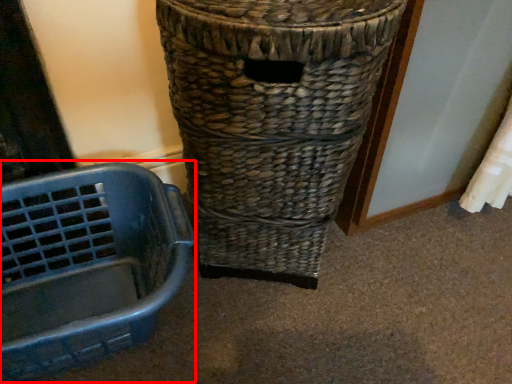
Question: Observing the image, what is the correct spatial positioning of basket container (annotated by the red box) in reference to waste container?

Choices:
 (A) right
 (B) left

Answer: (B)